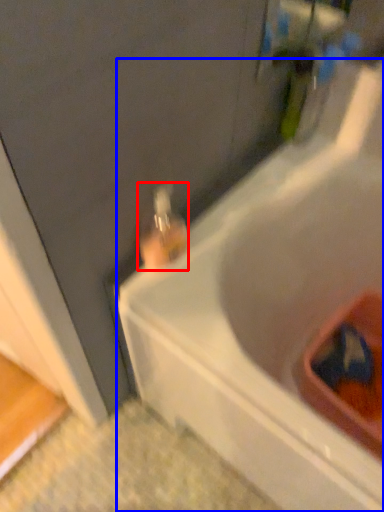
Question: Which of the following is the farthest to the observer, bottle (highlighted by a red box) or bathtub (highlighted by a blue box)?

Choices:
 (A) bottle
 (B) bathtub

Answer: (A)